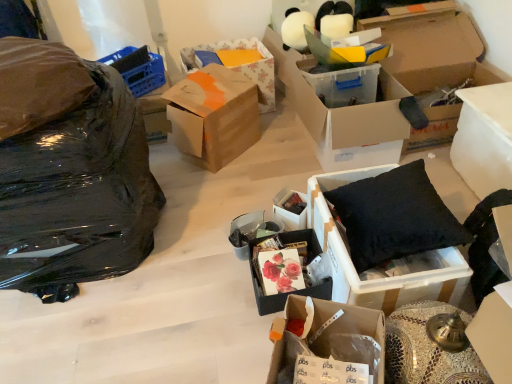
You are a GUI agent. You are given a task and a screenshot of the screen. Output one action in this format:
    pyautogui.click(x=<x>, y=<y>)
    Task: Click on the empty space that is in between brown cardboard box at center, which ranks as the ninth box in right-to-left order, and matte black box at center, the sixth box positioned from the right
    Image resolution: width=512 pixels, height=384 pixels.
    Given the screenshot: What is the action you would take?
    pyautogui.click(x=257, y=172)